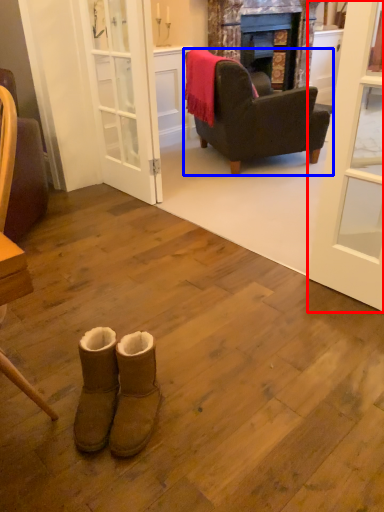
Question: Which object appears farthest to the camera in this image, door (highlighted by a red box) or chair (highlighted by a blue box)?

Choices:
 (A) door
 (B) chair

Answer: (B)